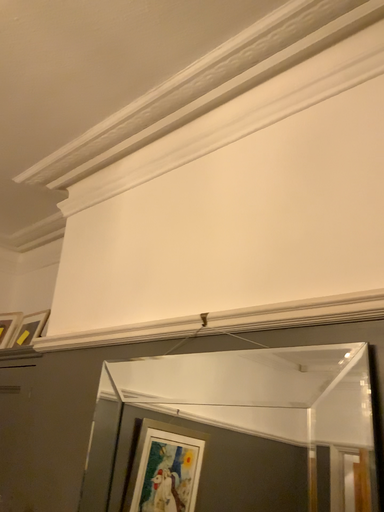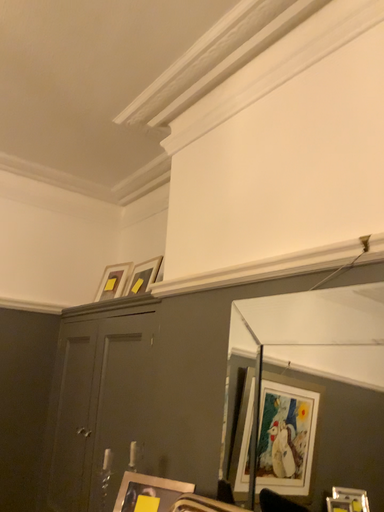
Question: How did the camera likely rotate when shooting the video?

Choices:
 (A) rotated right
 (B) rotated left

Answer: (B)